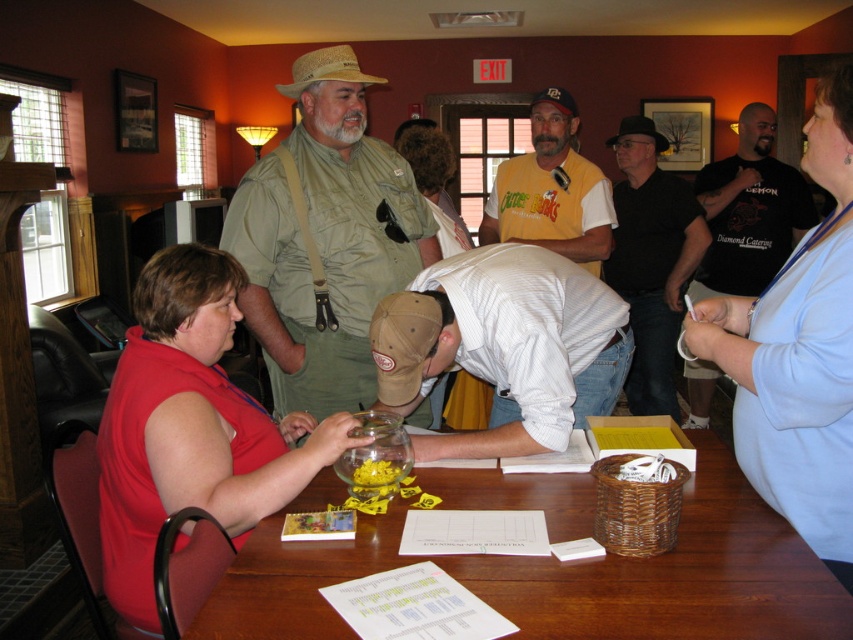
Is point (785, 552) farther from viewer compared to point (525, 188)?

No, it is in front of (525, 188).

Who is shorter, wooden table at lower center or yellow jersey at center?

wooden table at lower center is shorter.

This screenshot has width=853, height=640. Find the location of `wooden table at lower center`. wooden table at lower center is located at coordinates (558, 573).

The width and height of the screenshot is (853, 640). Identify the location of wooden table at lower center. (558, 573).

Is wooden table at lower center taller than black felt cowboy hat at upper center?

In fact, wooden table at lower center may be shorter than black felt cowboy hat at upper center.

Who is positioned more to the left, wooden table at lower center or black felt cowboy hat at upper center?

From the viewer's perspective, wooden table at lower center appears more on the left side.

Is point (544, 477) in front of point (659, 148)?

Yes, it is.

The height and width of the screenshot is (640, 853). I want to click on wooden table at lower center, so click(x=558, y=573).

Can you confirm if green canvas shirt at center is taller than black cotton shirt at center?

No, green canvas shirt at center is not taller than black cotton shirt at center.

Is green canvas shirt at center in front of black cotton shirt at center?

Yes.

Measure the distance between point (271, 365) and camera.

The distance of point (271, 365) from camera is 7.17 feet.

Where is `green canvas shirt at center`? green canvas shirt at center is located at coordinates (x=325, y=240).